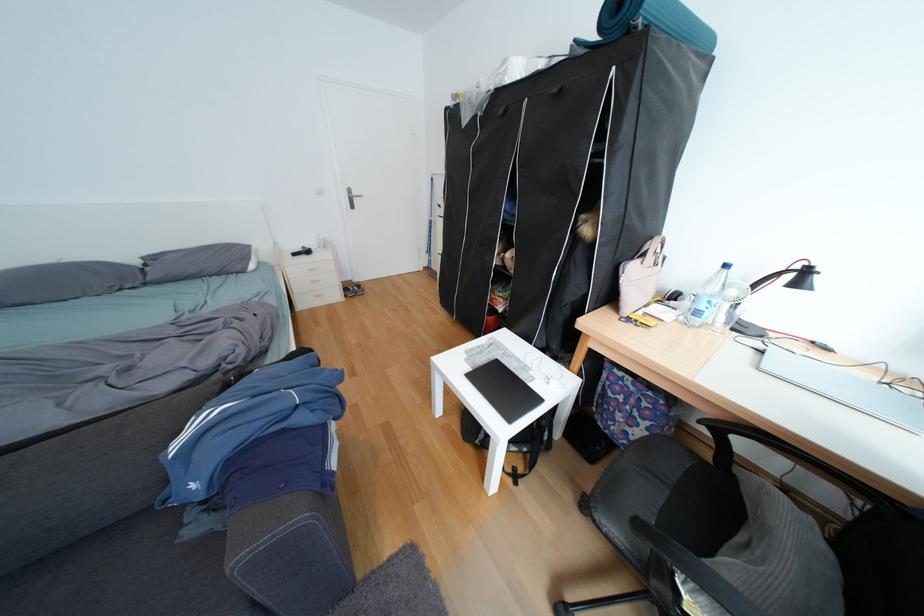
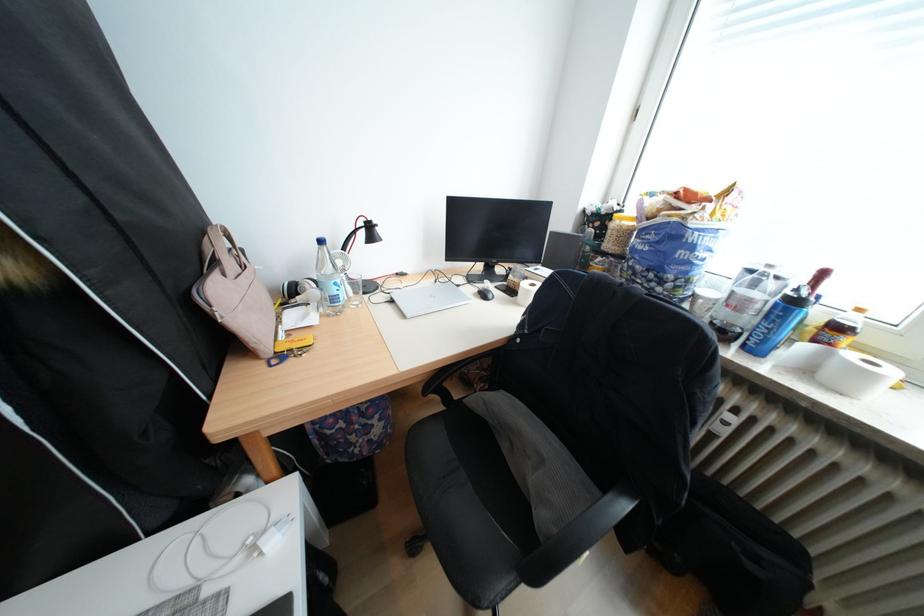
Where in the second image is the point corresponding to (657,256) from the first image?

(227, 264)